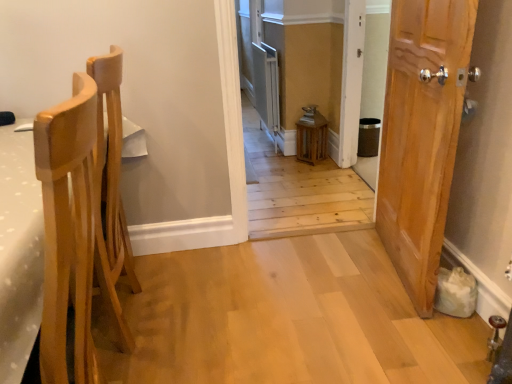
Question: Visually, is wooden door at right positioned to the left or to the right of wooden lantern at center?

Choices:
 (A) left
 (B) right

Answer: (B)

Question: In terms of width, does wooden door at right look wider or thinner when compared to wooden lantern at center?

Choices:
 (A) thin
 (B) wide

Answer: (B)

Question: Which object is the closest to the wooden lantern at center?

Choices:
 (A) wooden door at right
 (B) light wood chair at left

Answer: (A)

Question: Considering the real-world distances, which object is closest to the wooden lantern at center?

Choices:
 (A) wooden door at right
 (B) light wood chair at left

Answer: (A)